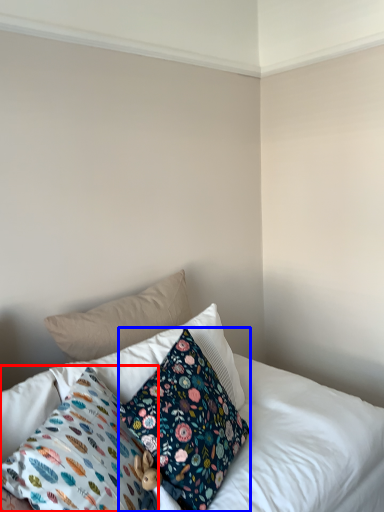
Question: Which of the following is the farthest to the observer, pillow (highlighted by a red box) or pillow (highlighted by a blue box)?

Choices:
 (A) pillow
 (B) pillow

Answer: (B)